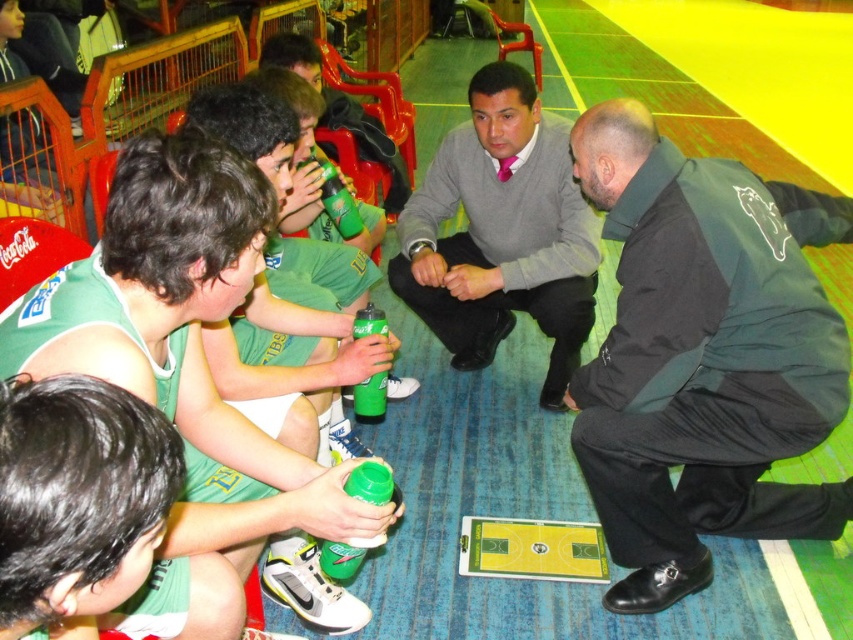
You are a photographer standing at the back of the basketball court. You need to take a photo of both the gray sweater at center and the matte green uniform at lower left. Can you see both subjects clearly in your current position?

The gray sweater at center is positioned over the matte green uniform at lower left, so the photographer may have difficulty seeing the matte green uniform at lower left clearly due to the gray sweater at center blocking the view.